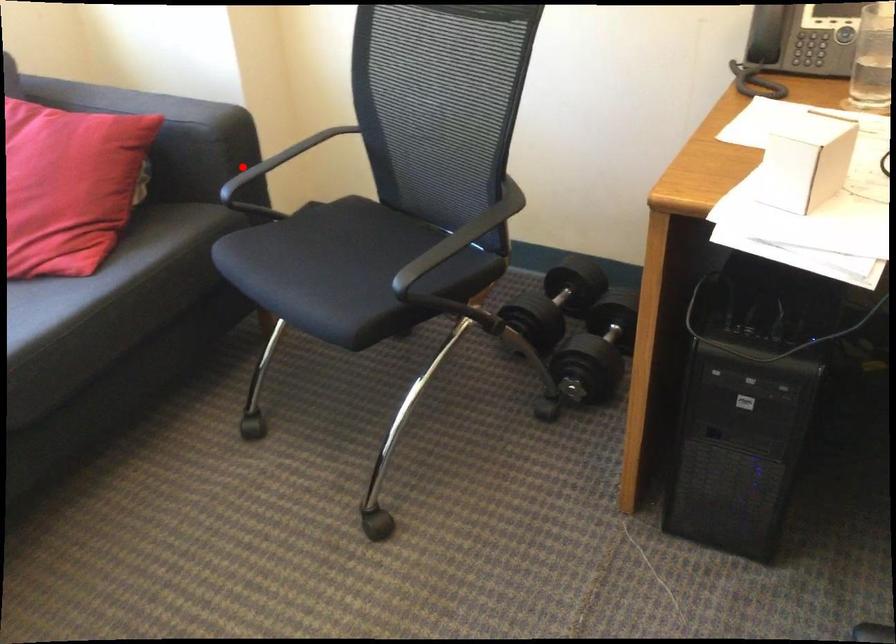
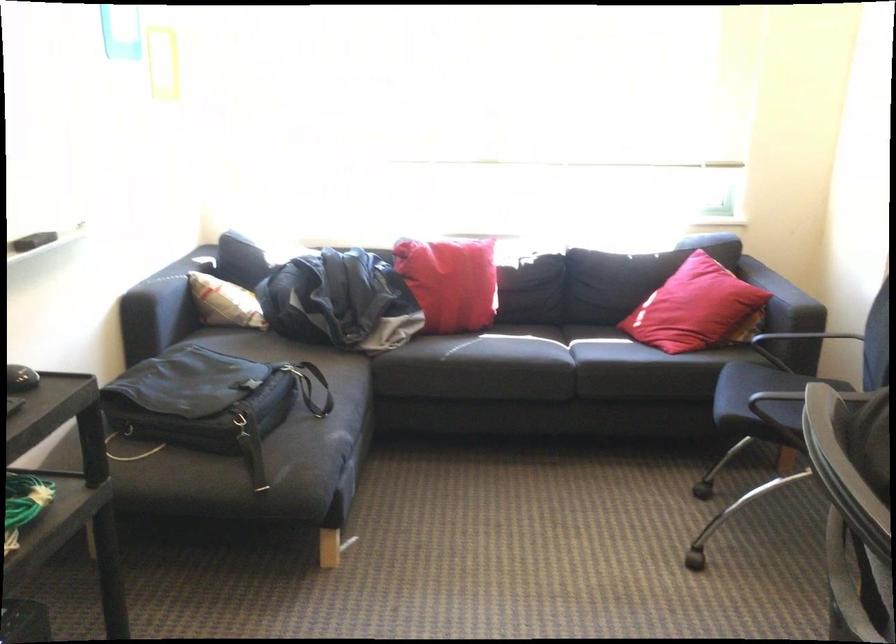
Question: I am providing you with two images of the same scene from different viewpoints. A red point is shown in image1. For the corresponding object point in image2, is it positioned nearer or farther from the camera?

Choices:
 (A) Nearer
 (B) Farther

Answer: (B)